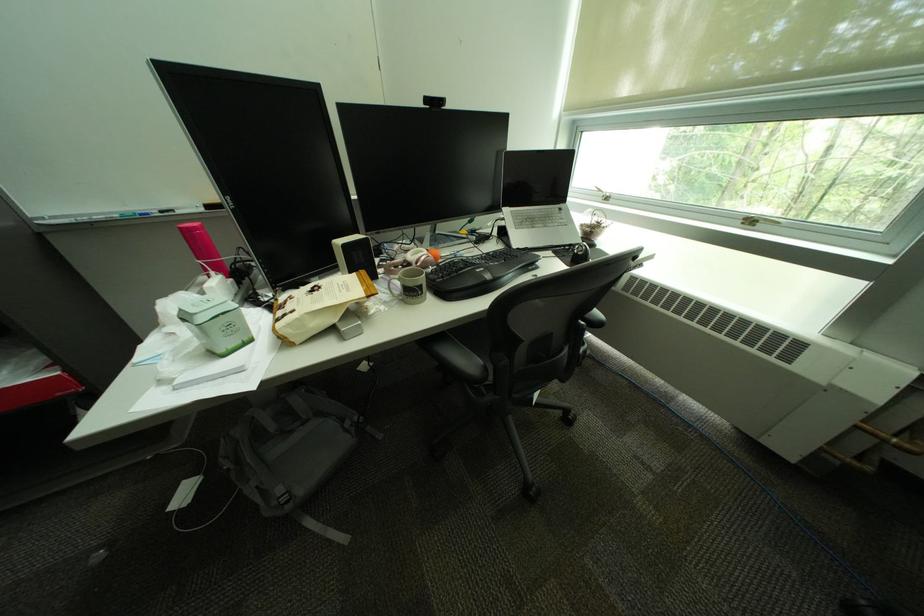
At what (x,y) coordinates should I click in order to perform the action: click on window handle. Please return your answer as a coordinate pair (x, y). Looking at the image, I should click on (770, 225).